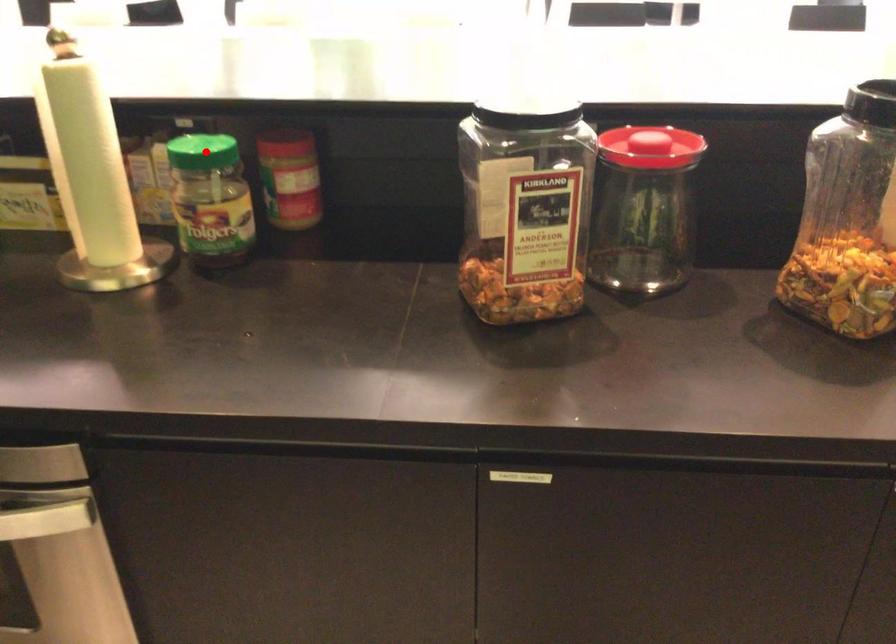
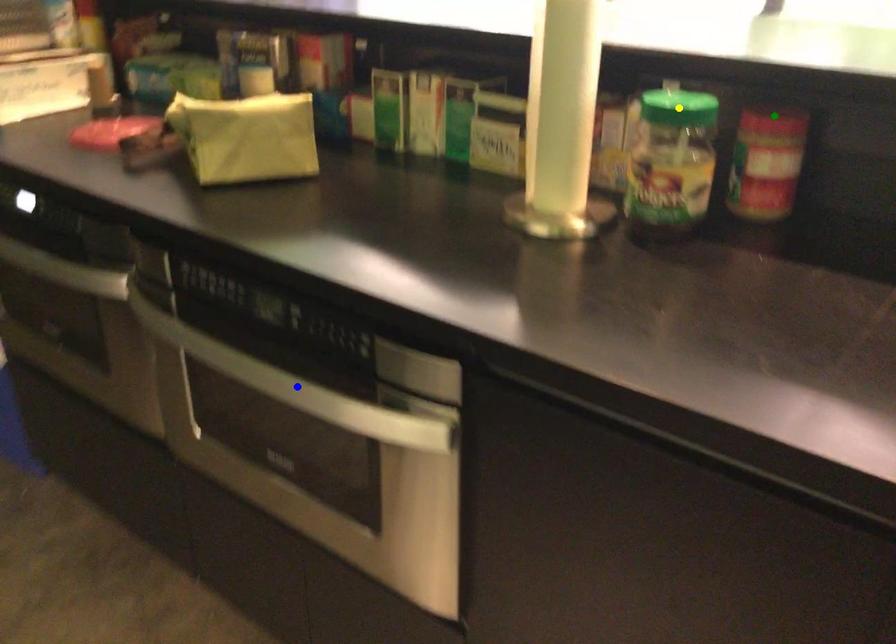
Question: I am providing you with two images of the same scene from different viewpoints. A red point is marked on the first image. You are given multiple points on the second image. In image 2, which mark is for the same physical point as the one in image 1?

Choices:
 (A) blue point
 (B) green point
 (C) yellow point

Answer: (C)